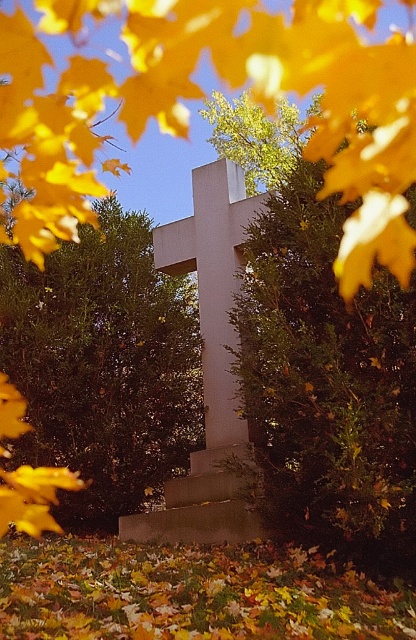
You are a gardener looking at the autumn scene. You see the yellow matte leaf at upper center and the green leafy bush at center. Which object is positioned higher in the image?

The yellow matte leaf at upper center is positioned higher than the green leafy bush at center.